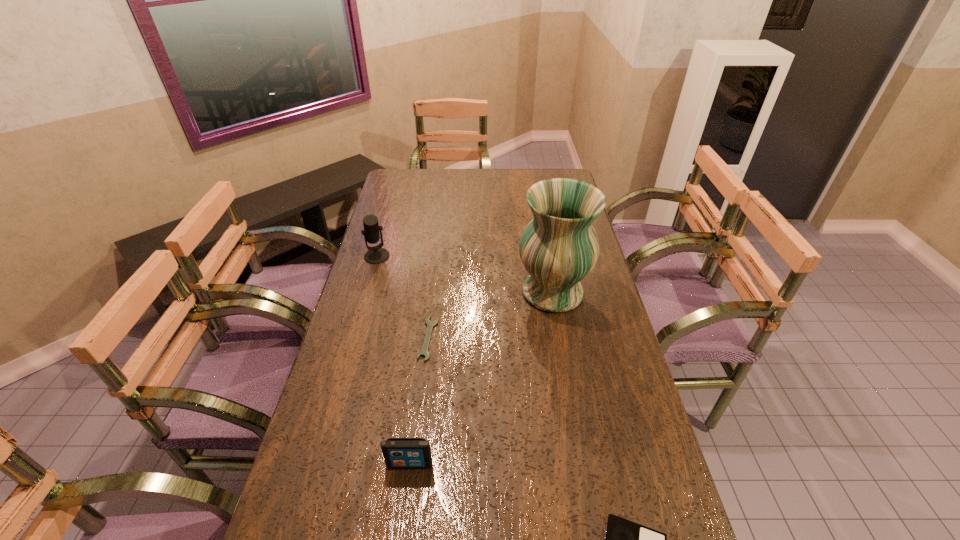
Find the location of a particular element. Image resolution: width=960 pixels, height=540 pixels. free spot between the shortest object and the farther iPod is located at coordinates (419, 401).

At what (x,y) coordinates should I click in order to perform the action: click on unoccupied position between the tallest object and the farther iPod. Please return your answer as a coordinate pair (x, y). This screenshot has width=960, height=540. Looking at the image, I should click on (481, 378).

Where is `empty location between the fourth shortest object and the third tallest object`? The width and height of the screenshot is (960, 540). empty location between the fourth shortest object and the third tallest object is located at coordinates tap(394, 360).

Identify which object is the third closest to the second shortest object. Please provide its 2D coordinates. Your answer should be formatted as a tuple, i.e. [(x, y)], where the tuple contains the x and y coordinates of a point satisfying the conditions above.

[(559, 247)]

Locate an element on the screen. The image size is (960, 540). object that is the second nearest to the vase is located at coordinates (375, 255).